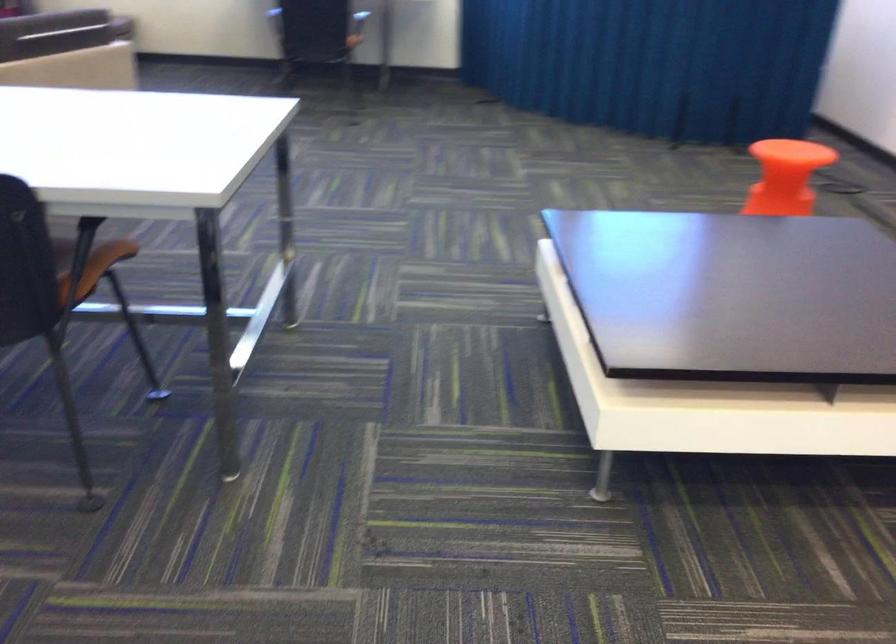
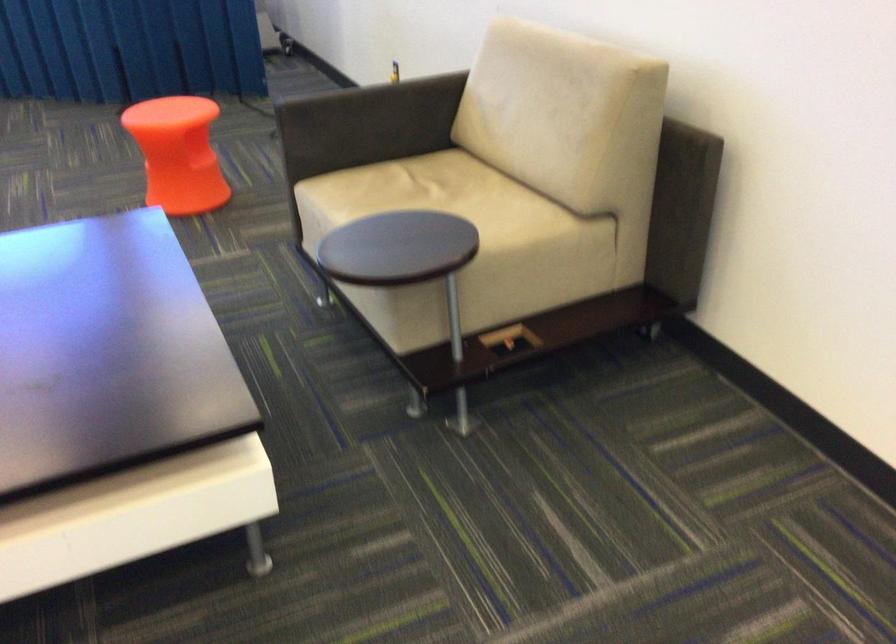
Find the pixel in the second image that matches pixel 806 180 in the first image.

(177, 154)